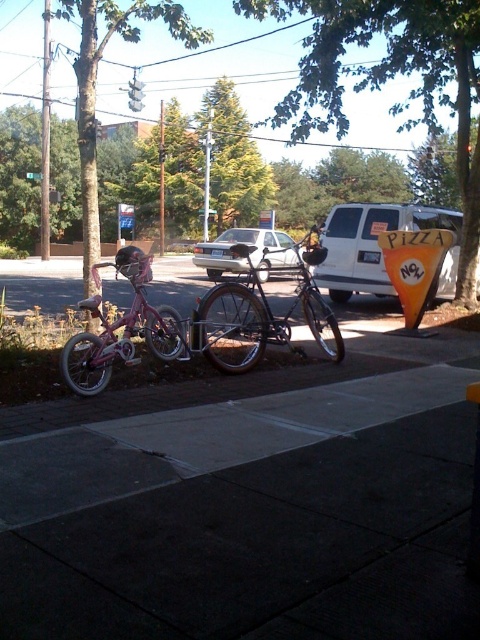
Question: Which point appears farthest from the camera in this image?

Choices:
 (A) (263, 323)
 (B) (84, 385)
 (C) (456, 275)

Answer: (C)

Question: Which of the following is the farthest from the observer?

Choices:
 (A) coord(447,289)
 (B) coord(301,292)

Answer: (A)

Question: Can you confirm if dark gray concrete sidewalk at lower center is positioned below white matte van at center?

Choices:
 (A) no
 (B) yes

Answer: (B)

Question: Observing the image, what is the correct spatial positioning of dark gray concrete sidewalk at lower center in reference to pink matte bicycle at left?

Choices:
 (A) above
 (B) below

Answer: (B)

Question: Does pink matte bicycle at left lie in front of white matte car at center?

Choices:
 (A) yes
 (B) no

Answer: (A)

Question: Which point is closer to the camera?

Choices:
 (A) shiny silver bicycle at center
 (B) pink matte bicycle at left
 (C) white matte car at center

Answer: (B)